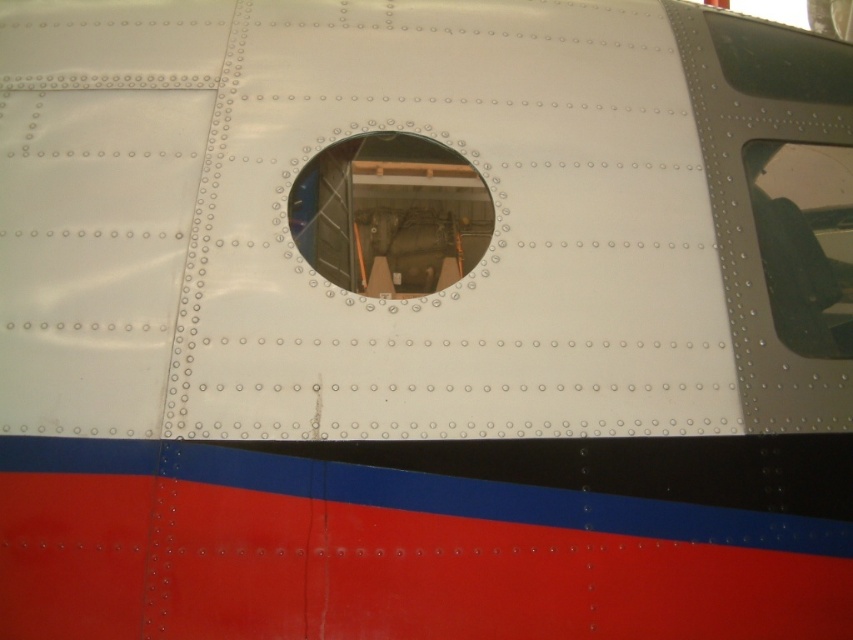
Question: Is glossy metal porthole at center below clear glass window at upper right?

Choices:
 (A) yes
 (B) no

Answer: (B)

Question: Does glossy metal porthole at center have a larger size compared to clear glass window at upper right?

Choices:
 (A) yes
 (B) no

Answer: (B)

Question: Which of the following is the closest to the observer?

Choices:
 (A) clear glass window at upper right
 (B) glossy metal porthole at center

Answer: (B)

Question: Does glossy metal porthole at center appear on the left side of clear glass window at upper right?

Choices:
 (A) no
 (B) yes

Answer: (B)

Question: Which point is closer to the camera?

Choices:
 (A) clear glass window at upper right
 (B) glossy metal porthole at center

Answer: (B)

Question: Among these objects, which one is nearest to the camera?

Choices:
 (A) clear glass window at upper right
 (B) glossy metal porthole at center

Answer: (B)